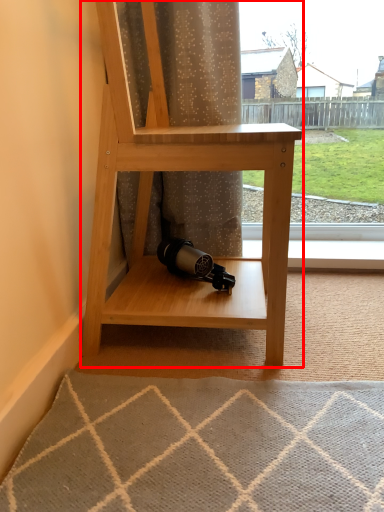
Question: From the image's perspective, where is shelf (annotated by the red box) located relative to curtain?

Choices:
 (A) above
 (B) below

Answer: (B)